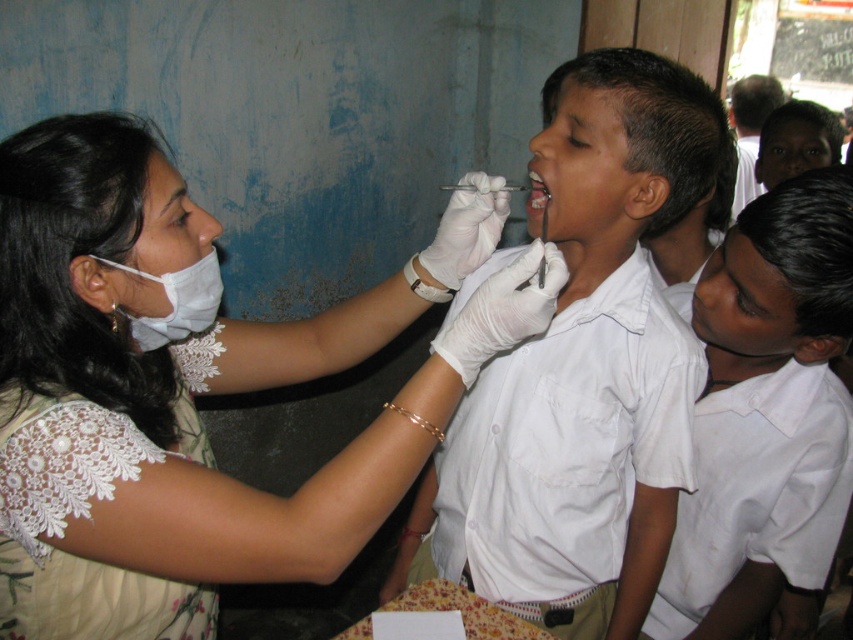
You are a photographer standing at a distance. You need to capture a closeup shot of the white lace dress at center. Based on the scene description, can you estimate whether you need to move closer or farther away to achieve the desired closeup?

The white lace dress at center is 32.94 inches away from the viewer. To capture a closeup shot, you would need to move closer to the dress since it is currently 32.94 inches away, which may be too far for a closeup.

You are a photographer taking a picture of the healthcare professional and the boy. You notice two points in the image labeled as point 1 at coordinates (86, 349) and point 2 at coordinates (634, 324). Which point is closer to the camera?

Point 1 at coordinates (86, 349) is closer to the camera than point 2 at coordinates (634, 324).